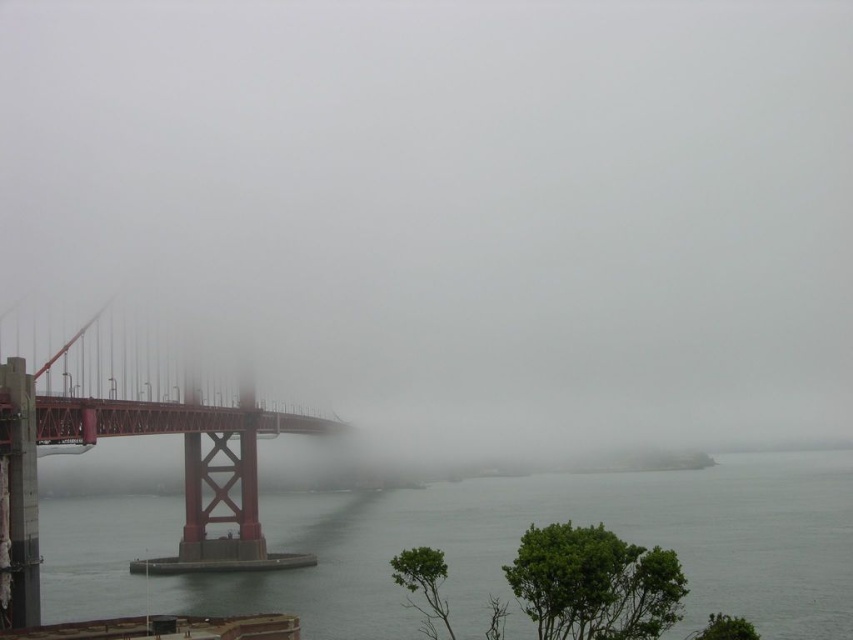
Does clear water at lower left appear under matte red suspension bridge at left?

Indeed, clear water at lower left is positioned under matte red suspension bridge at left.

Who is taller, clear water at lower left or matte red suspension bridge at left?

Standing taller between the two is clear water at lower left.

What are the coordinates of `clear water at lower left` in the screenshot? It's located at (486, 547).